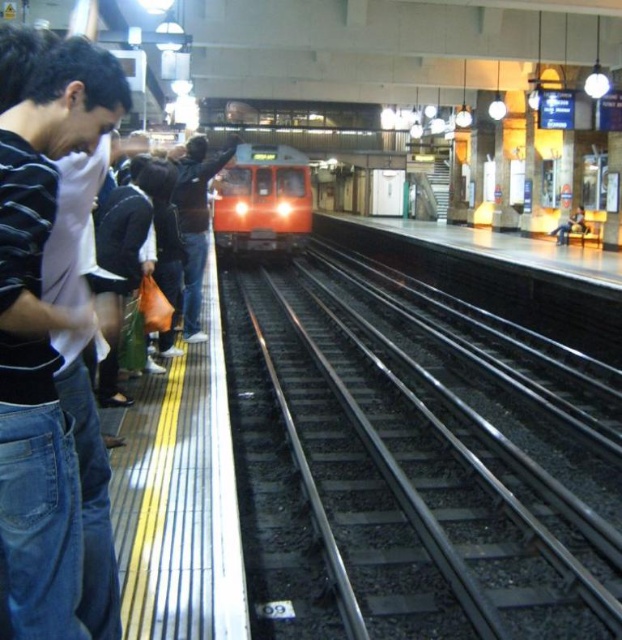
Question: Is orange glossy train at center positioned behind dark blue jeans at center?

Choices:
 (A) yes
 (B) no

Answer: (A)

Question: Can you confirm if black metal train track at center is thinner than orange glossy train at center?

Choices:
 (A) yes
 (B) no

Answer: (B)

Question: Which object is positioned closest to the dark blue jeans at center?

Choices:
 (A) black metal train track at center
 (B) orange glossy train at center
 (C) striped cotton shirt at left

Answer: (A)

Question: Which point appears farthest from the camera in this image?

Choices:
 (A) (271, 221)
 (B) (470, 461)

Answer: (A)

Question: Is striped cotton shirt at left below dark blue jeans at center?

Choices:
 (A) yes
 (B) no

Answer: (A)

Question: Based on their relative distances, which object is nearer to the dark blue jeans at center?

Choices:
 (A) striped cotton shirt at left
 (B) orange glossy train at center
 (C) black metal train track at center

Answer: (C)